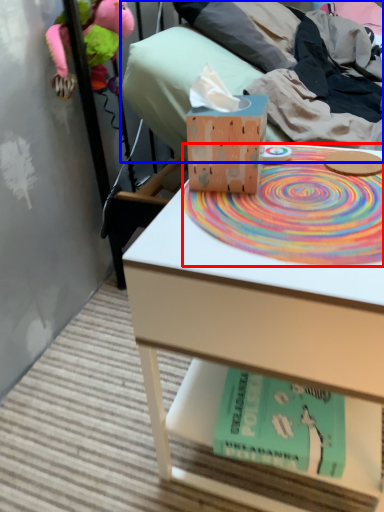
Question: Which of the following is the closest to the observer, mat (highlighted by a red box) or bed (highlighted by a blue box)?

Choices:
 (A) mat
 (B) bed

Answer: (A)